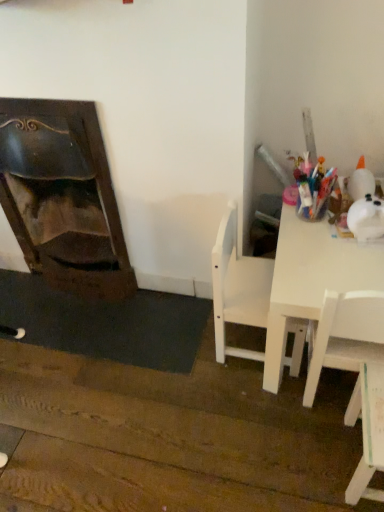
Image resolution: width=384 pixels, height=512 pixels. Find the location of `free space on the front side of white matte chair at center, placed as the first chair when sorted from left to right`. free space on the front side of white matte chair at center, placed as the first chair when sorted from left to right is located at coordinates (246, 405).